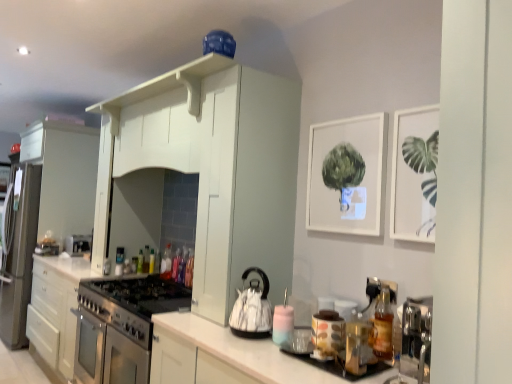
Question: Considering the relative positions of green glass bottle at center, the second bottle when ordered from back to front, and white glossy cabinet at center, placed as the first cabinetry when sorted from right to left, in the image provided, is green glass bottle at center, the second bottle when ordered from back to front, to the right of white glossy cabinet at center, placed as the first cabinetry when sorted from right to left, from the viewer's perspective?

Choices:
 (A) no
 (B) yes

Answer: (A)

Question: Is white glossy cabinet at center, which is counted as the 1th cabinetry, starting from the front, at the back of green glass bottle at center, the second bottle when ordered from back to front?

Choices:
 (A) no
 (B) yes

Answer: (A)

Question: Is white glossy cabinet at center, which is counted as the 1th cabinetry, starting from the front, completely or partially inside green glass bottle at center, the second bottle when ordered from back to front?

Choices:
 (A) yes
 (B) no

Answer: (B)

Question: Does green glass bottle at center, the second bottle when ordered from back to front, have a larger size compared to white glossy cabinet at center, which appears as the 3th cabinetry when viewed from the left?

Choices:
 (A) no
 (B) yes

Answer: (A)

Question: From the image's perspective, is green glass bottle at center, which is the 8th bottle from front to back, located above white glossy cabinet at center, which appears as the 3th cabinetry when viewed from the left?

Choices:
 (A) yes
 (B) no

Answer: (A)

Question: Is green glass bottle at center, arranged as the 8th bottle when viewed from the right, smaller than white glossy cabinet at center, which appears as the 3th cabinetry when viewed from the back?

Choices:
 (A) no
 (B) yes

Answer: (B)

Question: From the image's perspective, would you say white matte picture frame at upper center, the first picture frame viewed from the back, is shown under translucent glass bottle at right, arranged as the 8th bottle when viewed from the left?

Choices:
 (A) no
 (B) yes

Answer: (A)

Question: Is white matte picture frame at upper center, the 1th picture frame viewed from the left, at the left side of translucent glass bottle at right, acting as the 9th bottle starting from the back?

Choices:
 (A) no
 (B) yes

Answer: (A)

Question: Does white matte picture frame at upper center, the second picture frame in the right-to-left sequence, have a lesser height compared to translucent glass bottle at right, arranged as the 8th bottle when viewed from the left?

Choices:
 (A) yes
 (B) no

Answer: (B)

Question: Is white matte picture frame at upper center, the first picture frame viewed from the back, outside of translucent glass bottle at right, acting as the 9th bottle starting from the back?

Choices:
 (A) yes
 (B) no

Answer: (A)

Question: Can translucent glass bottle at right, the second bottle when ordered from right to left, be found inside white matte picture frame at upper center, the 1th picture frame viewed from the left?

Choices:
 (A) no
 (B) yes

Answer: (A)

Question: Considering the relative sizes of white matte picture frame at upper center, the 1th picture frame viewed from the left, and translucent glass bottle at right, arranged as the 8th bottle when viewed from the left, in the image provided, is white matte picture frame at upper center, the 1th picture frame viewed from the left, smaller than translucent glass bottle at right, arranged as the 8th bottle when viewed from the left,?

Choices:
 (A) yes
 (B) no

Answer: (B)

Question: Does translucent plastic bottle at center, placed as the 7th bottle when sorted from front to back, appear on the left side of white matte cabinet at upper center, positioned as the 2th cabinetry in back-to-front order?

Choices:
 (A) yes
 (B) no

Answer: (A)